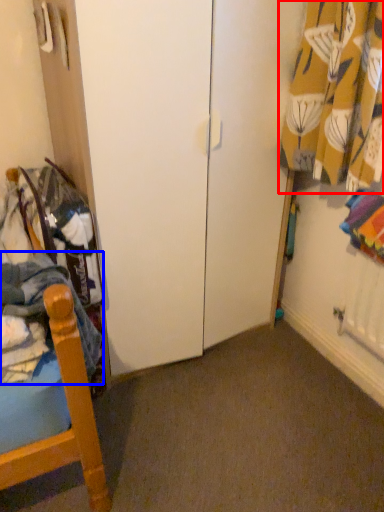
Question: Which object is further to the camera taking this photo, curtain (highlighted by a red box) or clothing (highlighted by a blue box)?

Choices:
 (A) curtain
 (B) clothing

Answer: (A)